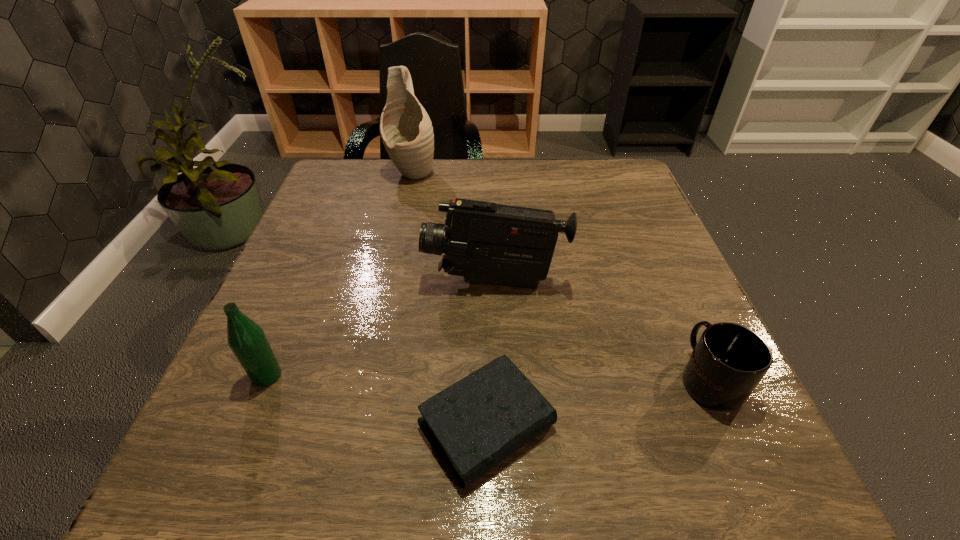
Where is `vacant space situated 0.190m on the front-facing side of the fourth nearest object`? The height and width of the screenshot is (540, 960). vacant space situated 0.190m on the front-facing side of the fourth nearest object is located at coordinates (328, 282).

Locate an element on the screen. free region located 0.130m on the front of the bottle is located at coordinates (228, 471).

This screenshot has width=960, height=540. Find the location of `vacant region located with the handle on the side of the rightmost object`. vacant region located with the handle on the side of the rightmost object is located at coordinates (677, 306).

Find the location of a particular element. Image resolution: width=960 pixels, height=540 pixels. vacant area situated with the handle on the side of the rightmost object is located at coordinates (644, 234).

The height and width of the screenshot is (540, 960). In order to click on free location located with the handle on the side of the rightmost object in this screenshot , I will do `click(644, 234)`.

Where is `vacant space located on the left of the shortest object`? The height and width of the screenshot is (540, 960). vacant space located on the left of the shortest object is located at coordinates (208, 425).

Locate an element on the screen. object present at the far edge is located at coordinates (406, 130).

At what (x,y) coordinates should I click in order to perform the action: click on object present at the near edge. Please return your answer as a coordinate pair (x, y). This screenshot has width=960, height=540. Looking at the image, I should click on tap(476, 423).

Locate an element on the screen. pitcher that is at the left edge is located at coordinates (406, 130).

Find the location of a particular element. The image size is (960, 540). bottle present at the left edge is located at coordinates (247, 340).